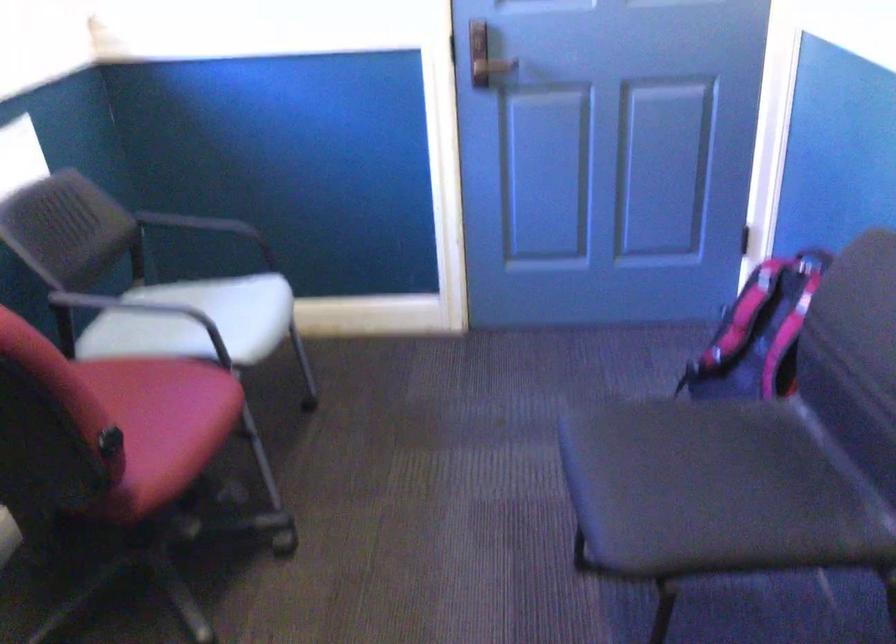
What are the coordinates of `door handle` in the screenshot? It's located at (492, 67).